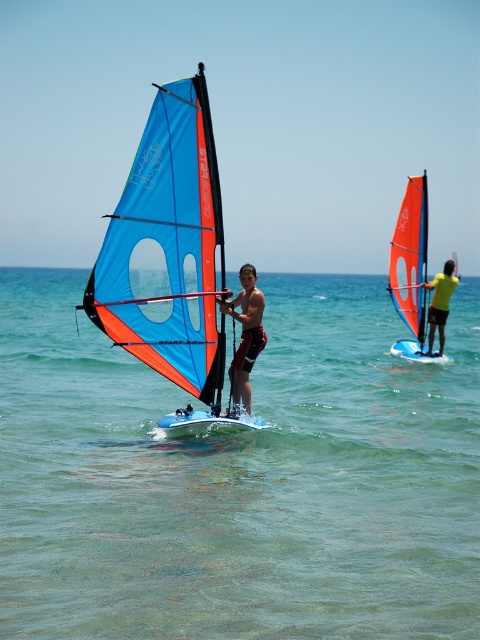
Question: Which object appears farthest from the camera in this image?

Choices:
 (A) matte black windsurfing board at center
 (B) blue matte sail at center
 (C) yellow matte surfboard at right

Answer: (C)

Question: Is clear blue water at center smaller than orange sail at right?

Choices:
 (A) no
 (B) yes

Answer: (A)

Question: Which of the following is the farthest from the observer?

Choices:
 (A) blue matte sail at center
 (B) orange sail at right
 (C) yellow matte surfboard at right
 (D) matte black windsurfing board at center

Answer: (B)

Question: Is orange sail at right thinner than matte black windsurfing board at center?

Choices:
 (A) yes
 (B) no

Answer: (A)

Question: Is clear blue water at center to the left of blue matte sail at center from the viewer's perspective?

Choices:
 (A) yes
 (B) no

Answer: (B)

Question: Which object is farther from the camera taking this photo?

Choices:
 (A) orange sail at right
 (B) blue matte sail at center
 (C) matte black windsurfing board at center
 (D) yellow matte surfboard at right

Answer: (A)